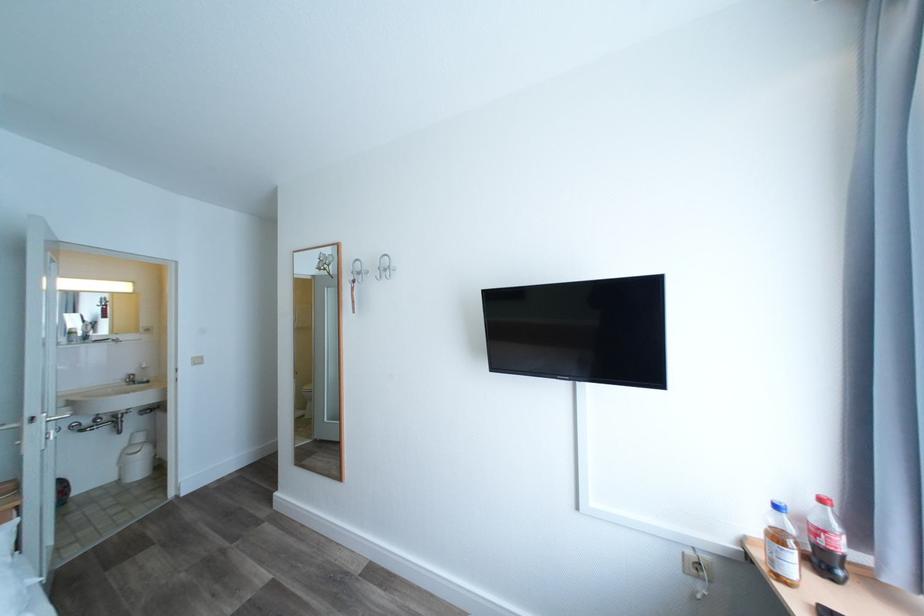
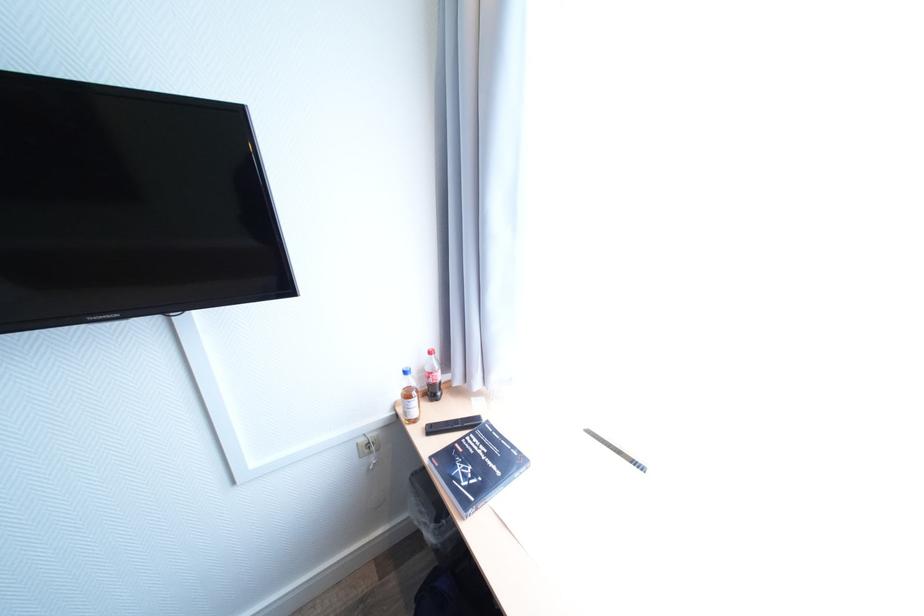
In the second image, find the point that corresponds to point (752, 539) in the first image.

(403, 403)